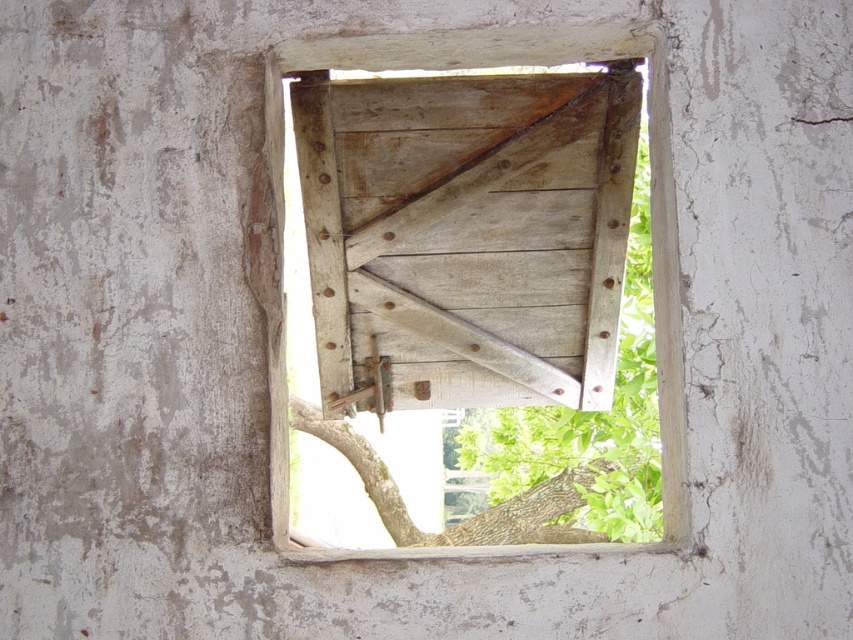
Question: Is wooden frame at center positioned at the back of wooden hinge at center?

Choices:
 (A) yes
 (B) no

Answer: (B)

Question: From the image, what is the correct spatial relationship of wooden frame at center in relation to wooden hinge at center?

Choices:
 (A) below
 (B) above

Answer: (A)

Question: Which object is farther from the camera taking this photo?

Choices:
 (A) wooden hinge at center
 (B) wooden frame at center

Answer: (A)

Question: Which point is farther from the camera taking this photo?

Choices:
 (A) (610, 209)
 (B) (323, 182)

Answer: (A)

Question: Is wooden frame at center positioned in front of wooden hinge at center?

Choices:
 (A) yes
 (B) no

Answer: (A)

Question: Which object appears closest to the camera in this image?

Choices:
 (A) wooden hinge at center
 (B) wooden frame at center

Answer: (B)